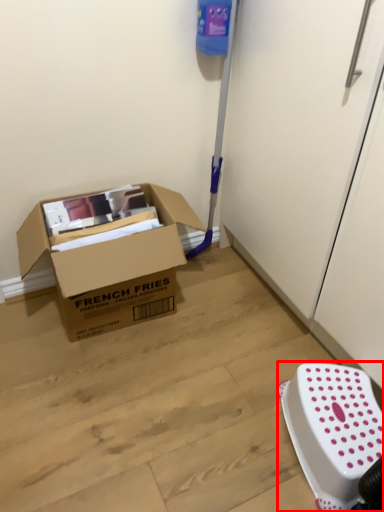
Question: From the image's perspective, where is stool (annotated by the red box) located in relation to box in the image?

Choices:
 (A) below
 (B) above

Answer: (A)